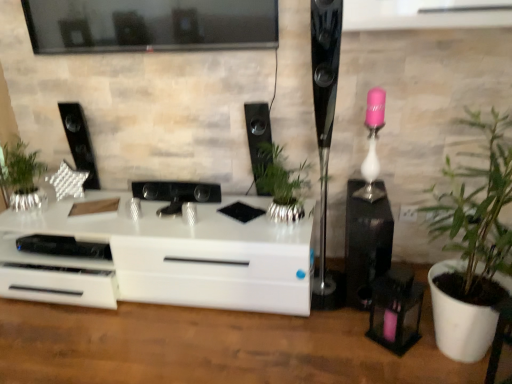
Image resolution: width=512 pixels, height=384 pixels. I want to click on empty space that is ontop of white glossy chest of drawers at center (from a real-world perspective), so click(152, 209).